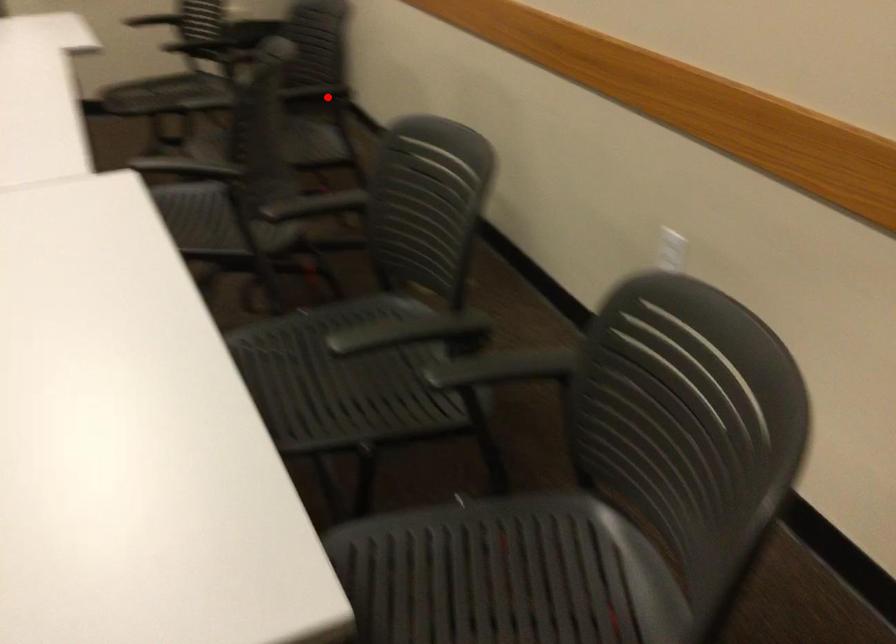
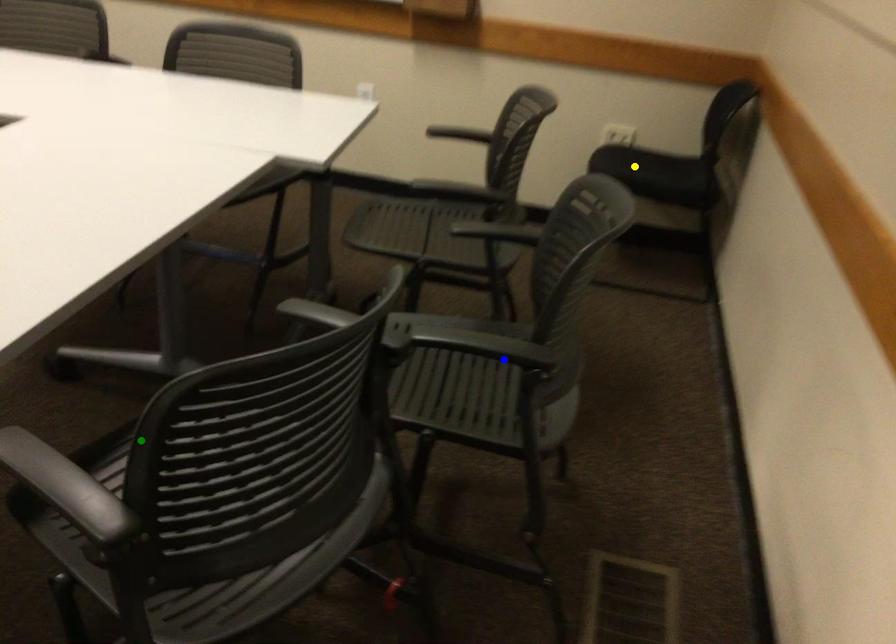
Question: I am providing you with two images of the same scene from different viewpoints. A red point is marked on the first image. You are given multiple points on the second image. Which mark in image 2 goes with the point in image 1?

Choices:
 (A) green point
 (B) blue point
 (C) yellow point

Answer: (B)